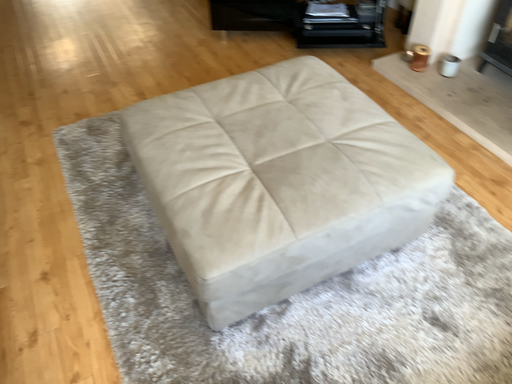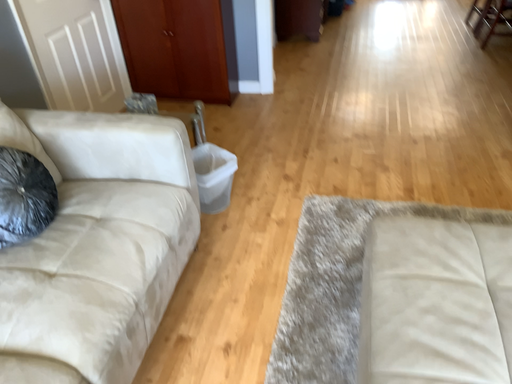
Question: Which way did the camera rotate in the video?

Choices:
 (A) rotated downward
 (B) rotated upward

Answer: (B)